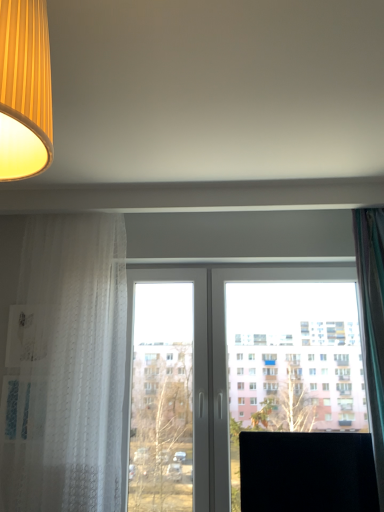
Question: Is green sheer curtain at right, which is the 2th curtain from left to right, in front of or behind matte yellow fabric lampshade at upper left in the image?

Choices:
 (A) behind
 (B) front

Answer: (A)

Question: From a real-world perspective, is green sheer curtain at right, the first curtain in the right-to-left sequence, physically located above or below matte yellow fabric lampshade at upper left?

Choices:
 (A) below
 (B) above

Answer: (A)

Question: Considering the real-world distances, which object is farthest from the black matte computer monitor at lower right?

Choices:
 (A) green sheer curtain at right, which is the 2th curtain from left to right
 (B) transparent glass window at center
 (C) matte yellow fabric lampshade at upper left
 (D) white sheer curtain at left, the 1th curtain viewed from the left

Answer: (C)

Question: Which of these objects is positioned farthest from the black matte computer monitor at lower right?

Choices:
 (A) green sheer curtain at right, which is the 2th curtain from left to right
 (B) transparent glass window at center
 (C) matte yellow fabric lampshade at upper left
 (D) white sheer curtain at left, placed as the second curtain when sorted from right to left

Answer: (C)